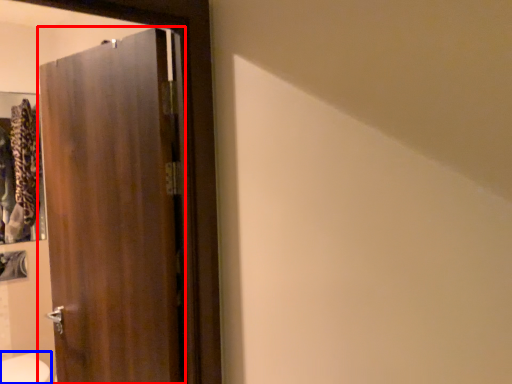
Question: Which object appears farthest to the camera in this image, door (highlighted by a red box) or bidet (highlighted by a blue box)?

Choices:
 (A) door
 (B) bidet

Answer: (B)